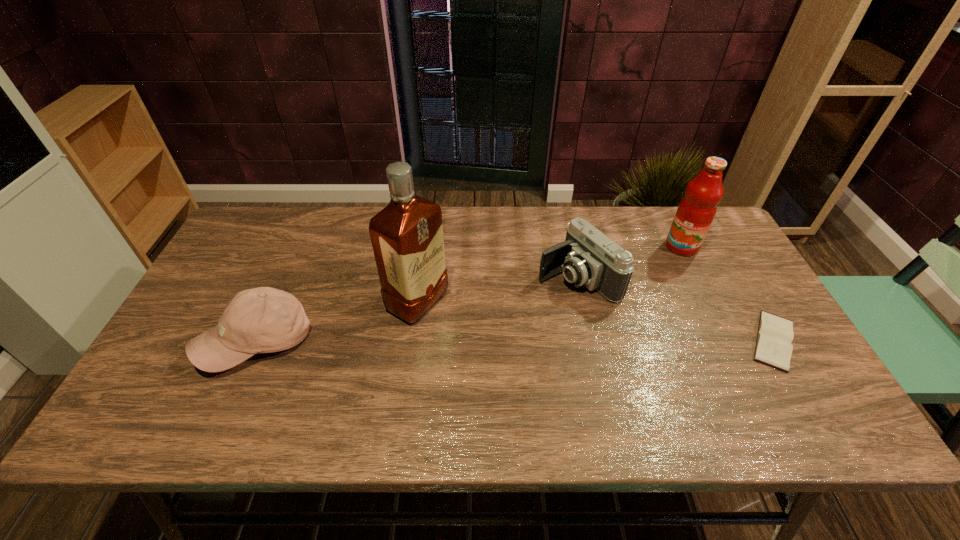
Image resolution: width=960 pixels, height=540 pixels. Identify the location of vacant area situated on the front label of the fourth shortest object. (659, 271).

Locate an element on the screen. The image size is (960, 540). blank space located on the front label of the fourth shortest object is located at coordinates (637, 293).

Image resolution: width=960 pixels, height=540 pixels. I want to click on free space located on the front label of the fourth shortest object, so click(666, 263).

The height and width of the screenshot is (540, 960). I want to click on vacant region located at the front of the camera with an open lens cover, so click(x=452, y=338).

You are a GUI agent. You are given a task and a screenshot of the screen. Output one action in this format:
    pyautogui.click(x=<x>, y=<y>)
    Task: Click on the vacant region located 0.360m at the front of the camera with an open lens cover
    
    Given the screenshot: What is the action you would take?
    pyautogui.click(x=431, y=348)

Where is `vacant space located at the front of the camera with an open lens cover`? The image size is (960, 540). vacant space located at the front of the camera with an open lens cover is located at coordinates tap(501, 314).

Identify the location of fruit juice located in the far edge section of the desktop. pos(696,211).

You are a GUI agent. You are given a task and a screenshot of the screen. Output one action in this format:
    pyautogui.click(x=<x>, y=<y>)
    Task: Click on the camera that is at the far edge
    The image size is (960, 540).
    Given the screenshot: What is the action you would take?
    pyautogui.click(x=588, y=257)

Locate an element on the screen. The height and width of the screenshot is (540, 960). baseball cap that is at the near edge is located at coordinates (261, 320).

This screenshot has height=540, width=960. I want to click on diary present at the near edge, so click(775, 333).